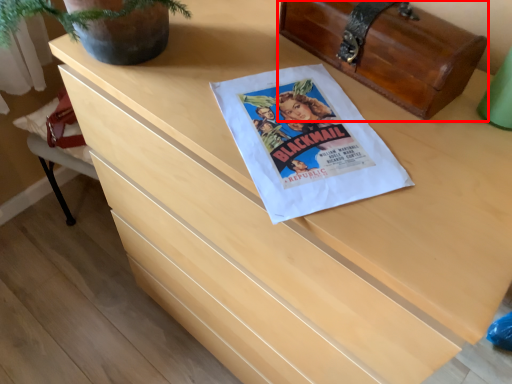
Question: From the image, what is the correct spatial relationship of chest (annotated by the red box) in relation to flyer?

Choices:
 (A) left
 (B) right

Answer: (B)